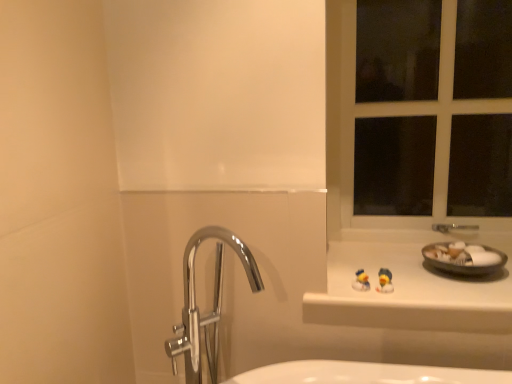
At what (x,y) coordinates should I click in order to perform the action: click on vacant area located to the right-hand side of yellow rubber duck at center, which appears as the second miniature when viewed from the left. Please return your answer as a coordinate pair (x, y). Image resolution: width=512 pixels, height=384 pixels. Looking at the image, I should click on tap(436, 292).